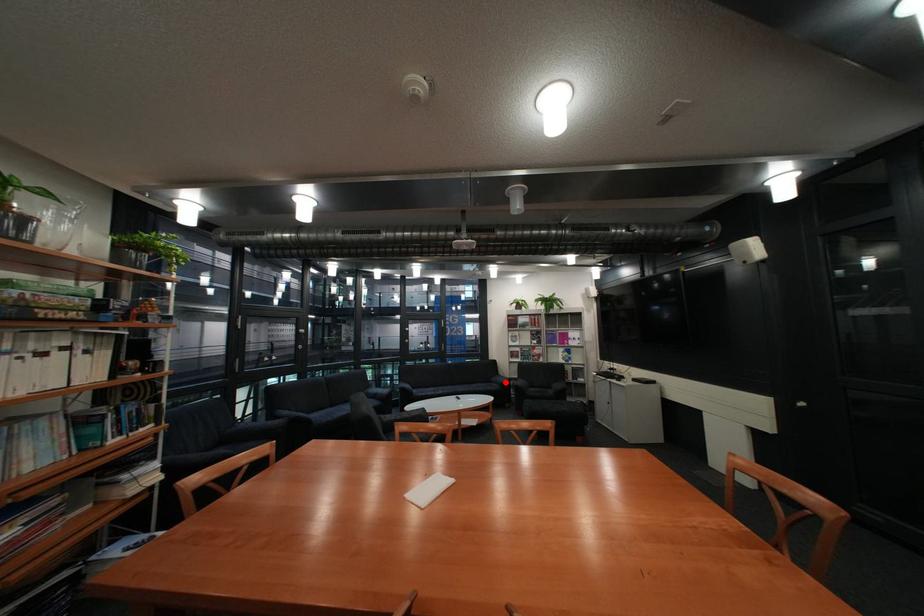
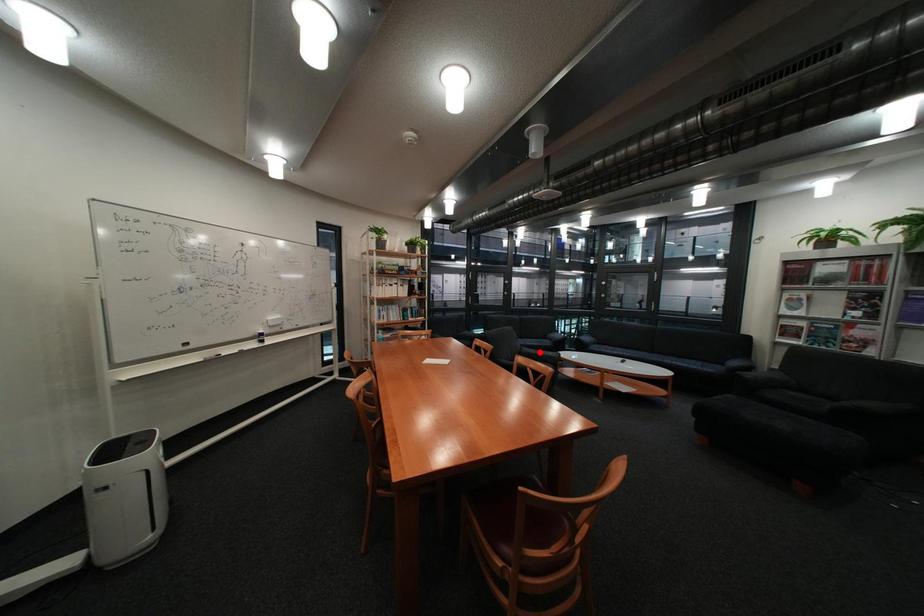
I am providing you with two images of the same scene from different viewpoints. A red point is marked on the first image and another point is marked on the second image. Are the points marked in image1 and image2 representing the same 3D position?

No